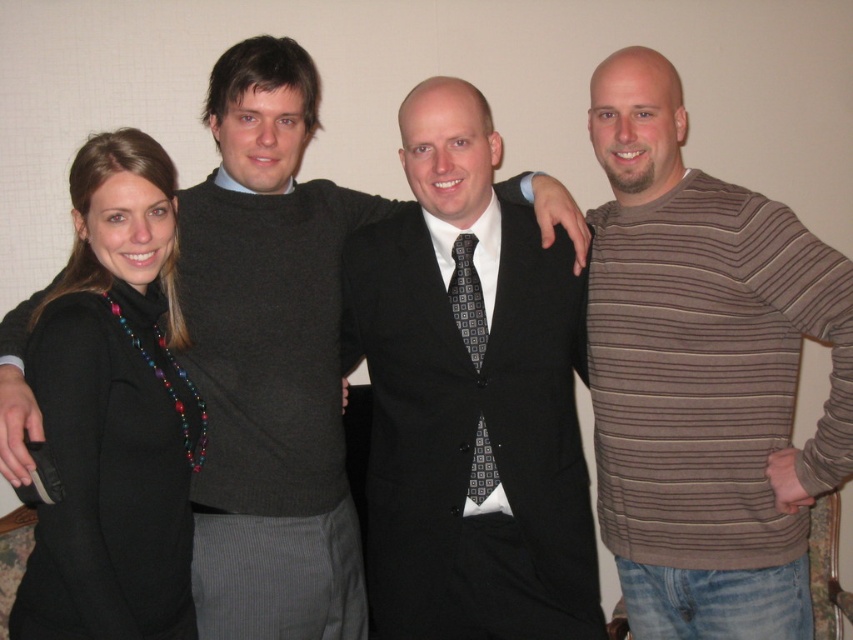
Does matte black suit at center appear over black matte coat at left?

Indeed, matte black suit at center is positioned over black matte coat at left.

Is point (459, 129) closer to camera compared to point (61, 358)?

That is False.

Where is `matte black suit at center`? The width and height of the screenshot is (853, 640). matte black suit at center is located at coordinates (469, 397).

Who is taller, black matte coat at left or black textured tie at center?

black matte coat at left is taller.

Does black matte coat at left appear on the right side of black textured tie at center?

No, black matte coat at left is not to the right of black textured tie at center.

Is point (161, 305) behind point (483, 484)?

That is False.

The height and width of the screenshot is (640, 853). I want to click on black matte coat at left, so click(114, 412).

Is black sweater at left thinner than black matte coat at left?

In fact, black sweater at left might be wider than black matte coat at left.

Between point (331, 406) and point (77, 348), which one is positioned behind?

Point (331, 406)

Locate an element on the screen. black sweater at left is located at coordinates (270, 360).